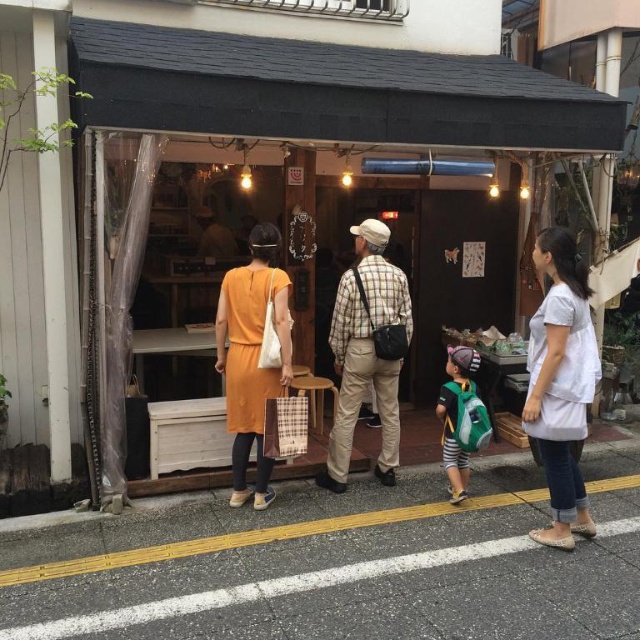
You are standing on the gray asphalt at lower center. What is the 2D coordinate of your current position?

The 2D coordinate of your current position on the gray asphalt at lower center is point (337, 563).